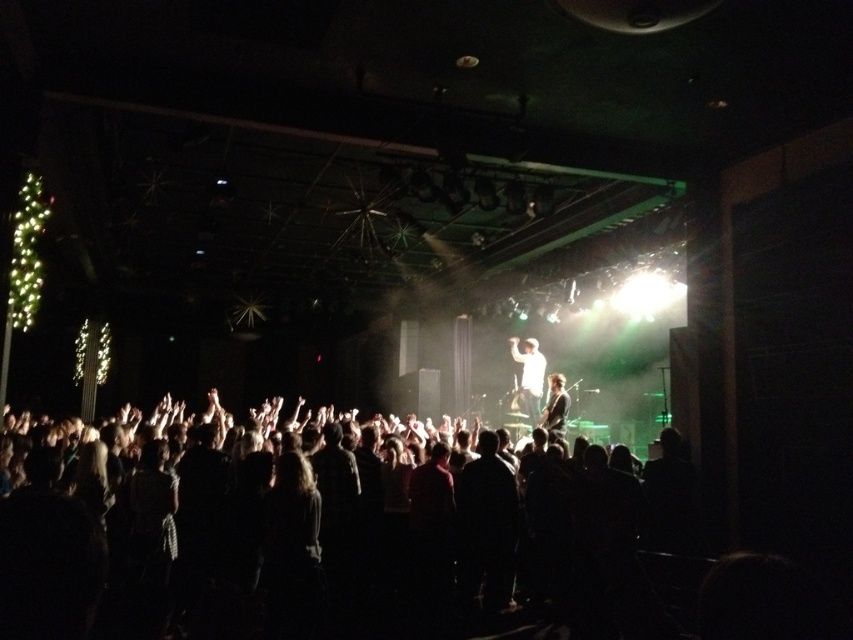
Between point (329, 481) and point (532, 348), which one is positioned in front?

Point (329, 481) is more forward.

Which is below, dark clothing crowd at center or white matte shirt at center?

dark clothing crowd at center is lower down.

Is point (33, 625) farther from viewer compared to point (523, 380)?

No.

I want to click on dark clothing crowd at center, so click(306, 536).